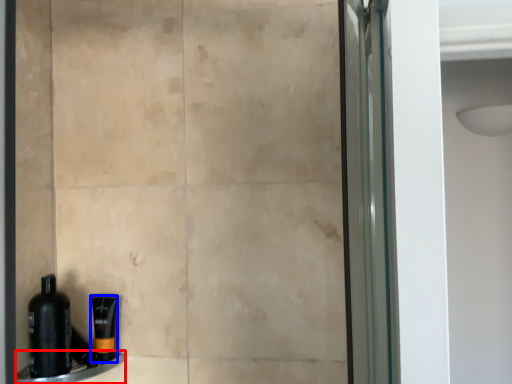
Question: Which of the following is the closest to the observer, ledge (highlighted by a red box) or toiletry (highlighted by a blue box)?

Choices:
 (A) ledge
 (B) toiletry

Answer: (A)